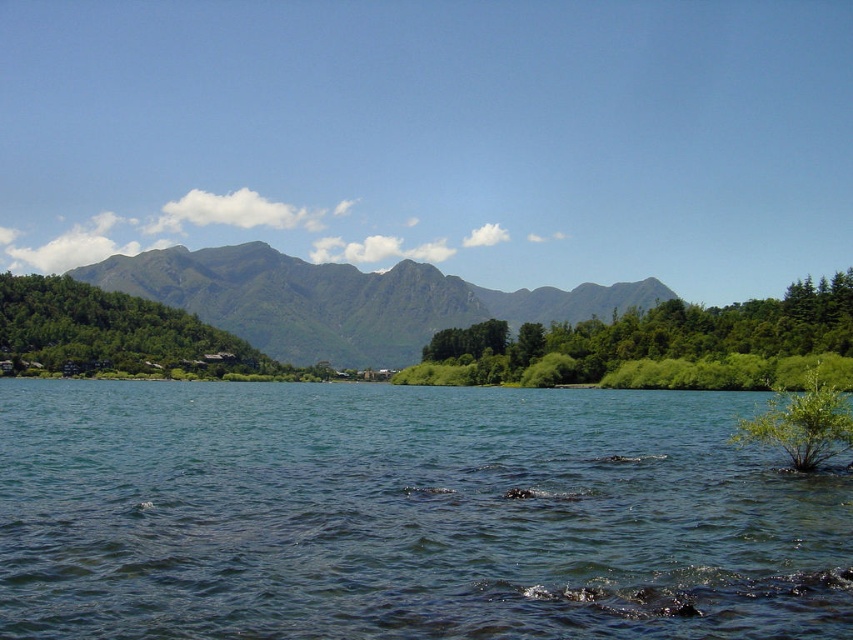
Question: Among these points, which one is farthest from the camera?

Choices:
 (A) (682, 387)
 (B) (390, 273)

Answer: (B)

Question: In this image, where is green leafy trees at center located relative to green leafy hillside at left?

Choices:
 (A) left
 (B) right

Answer: (B)

Question: Considering the real-world distances, which object is closest to the green leafy hillside at left?

Choices:
 (A) green textured mountain at center
 (B) clear blue water at center
 (C) green leafy trees at center

Answer: (A)

Question: Does green textured mountain at center have a larger size compared to green leafy trees at center?

Choices:
 (A) yes
 (B) no

Answer: (A)

Question: Which object is closer to the camera taking this photo?

Choices:
 (A) green leafy trees at center
 (B) green leafy hillside at left
 (C) green textured mountain at center

Answer: (A)

Question: From the image, what is the correct spatial relationship of clear blue water at center in relation to green leafy hillside at left?

Choices:
 (A) left
 (B) right

Answer: (B)